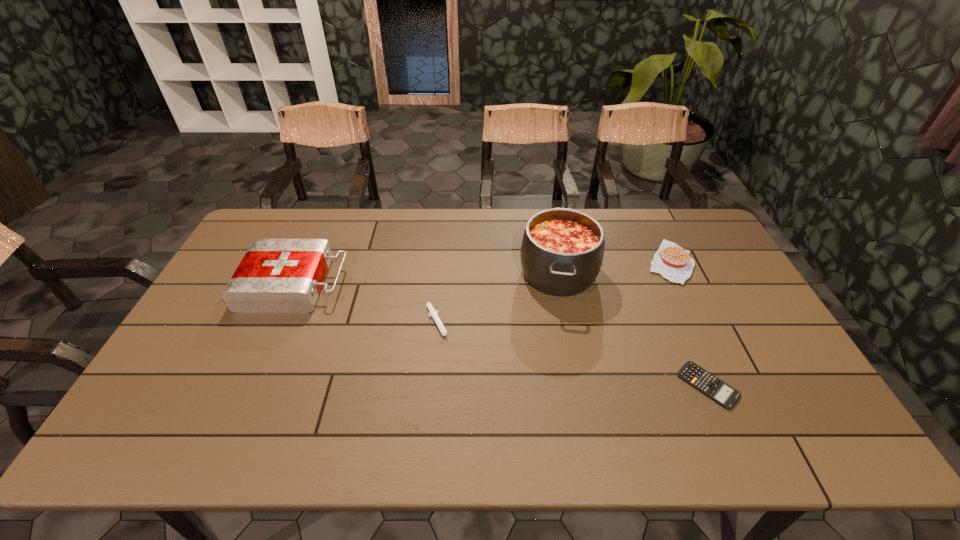
The width and height of the screenshot is (960, 540). What are the coordinates of `the third object from right to left` in the screenshot? It's located at (562, 249).

You are a GUI agent. You are given a task and a screenshot of the screen. Output one action in this format:
    pyautogui.click(x=<x>, y=<y>)
    Task: Click on the tallest object
    
    Given the screenshot: What is the action you would take?
    pyautogui.click(x=562, y=249)

This screenshot has height=540, width=960. In order to click on the first-aid kit in this screenshot , I will do `click(276, 275)`.

You are a GUI agent. You are given a task and a screenshot of the screen. Output one action in this format:
    pyautogui.click(x=<x>, y=<y>)
    Task: Click on the second tallest object
    
    Given the screenshot: What is the action you would take?
    pyautogui.click(x=276, y=275)

You are a GUI agent. You are given a task and a screenshot of the screen. Output one action in this format:
    pyautogui.click(x=<x>, y=<y>)
    Task: Click on the third shortest object
    
    Given the screenshot: What is the action you would take?
    pyautogui.click(x=675, y=264)

You are a GUI agent. You are given a task and a screenshot of the screen. Output one action in this format:
    pyautogui.click(x=<x>, y=<y>)
    Task: Click on the second shortest object
    The height and width of the screenshot is (540, 960).
    Given the screenshot: What is the action you would take?
    pyautogui.click(x=434, y=313)

The image size is (960, 540). Find the location of `the fourth object from right to left`. the fourth object from right to left is located at coordinates (434, 313).

Locate an element on the screen. the shortest object is located at coordinates (722, 393).

Locate an element on the screen. This screenshot has width=960, height=540. the nearest object is located at coordinates (722, 393).

What are the coordinates of `vacant region located on the left of the tallest object` in the screenshot? It's located at 401,273.